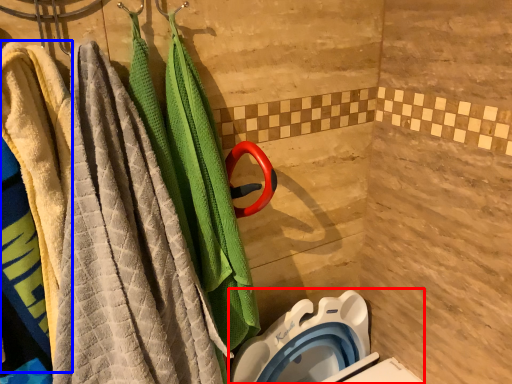
Question: Which object is closer to the camera taking this photo, toilet bowl (highlighted by a red box) or beach towel (highlighted by a blue box)?

Choices:
 (A) toilet bowl
 (B) beach towel

Answer: (B)